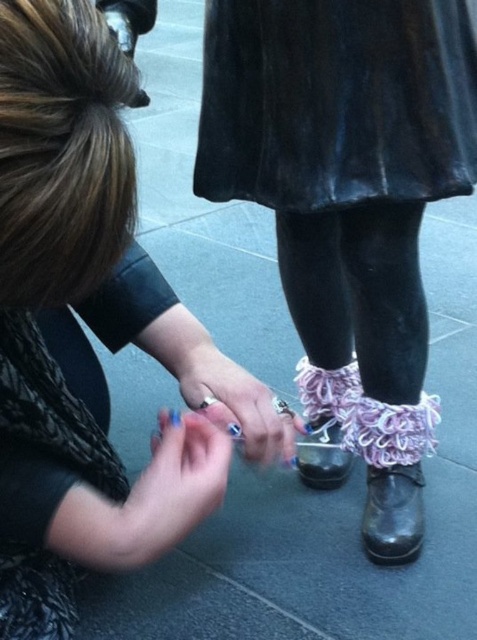
Does velvet black dress at upper center have a larger size compared to black leather shoe at lower center?

→ Indeed, velvet black dress at upper center has a larger size compared to black leather shoe at lower center.

Where is `velvet black dress at upper center`? velvet black dress at upper center is located at coordinates (336, 100).

In the scene shown: Does blue painted nails at center have a larger size compared to black leather shoe at lower center?

Correct, blue painted nails at center is larger in size than black leather shoe at lower center.

Does blue painted nails at center appear on the right side of black leather shoe at lower center?

No, blue painted nails at center is not to the right of black leather shoe at lower center.

Image resolution: width=477 pixels, height=640 pixels. Identify the location of blue painted nails at center. (174, 488).

You are a GUI agent. You are given a task and a screenshot of the screen. Output one action in this format:
    pyautogui.click(x=<x>, y=<y>)
    Task: Click on the blue painted nails at center
    Image resolution: width=477 pixels, height=640 pixels.
    Given the screenshot: What is the action you would take?
    pyautogui.click(x=174, y=488)

Does pink lace socks at lower right have a lesser height compared to ruffled fabric socks at center?

Indeed, pink lace socks at lower right has a lesser height compared to ruffled fabric socks at center.

Measure the distance between pink lace socks at lower right and camera.

A distance of 15.86 inches exists between pink lace socks at lower right and camera.

At what (x,y) coordinates should I click in order to perform the action: click on pink lace socks at lower right. Please return your answer as a coordinate pair (x, y). This screenshot has height=640, width=477. Looking at the image, I should click on (93, 330).